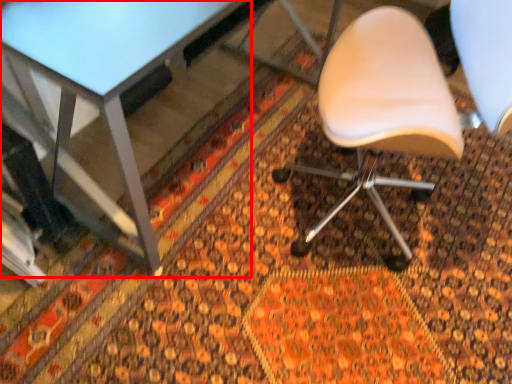
Question: From the image, what is the correct spatial relationship of table (annotated by the red box) in relation to chair?

Choices:
 (A) right
 (B) left

Answer: (B)